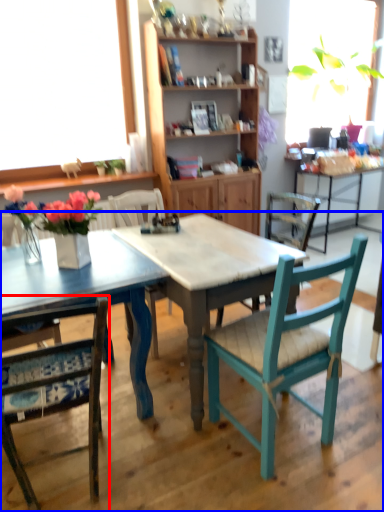
Question: Among these objects, which one is farthest to the camera, chair (highlighted by a red box) or table (highlighted by a blue box)?

Choices:
 (A) chair
 (B) table

Answer: (A)